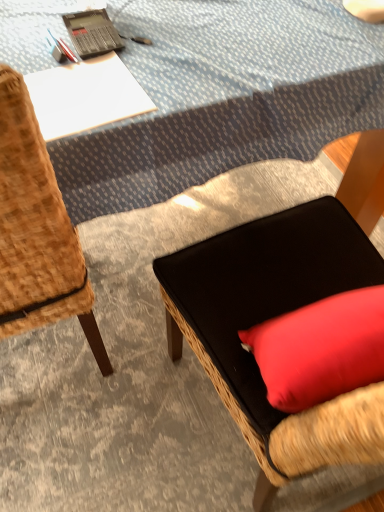
Where is `vacant space that is to the left of black plastic calculator at upper left`? The width and height of the screenshot is (384, 512). vacant space that is to the left of black plastic calculator at upper left is located at coordinates (29, 32).